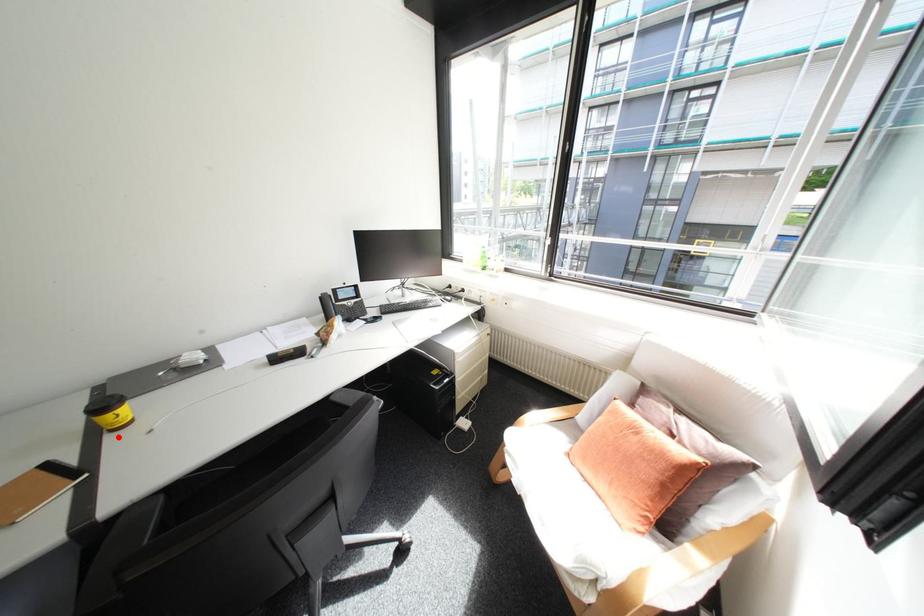
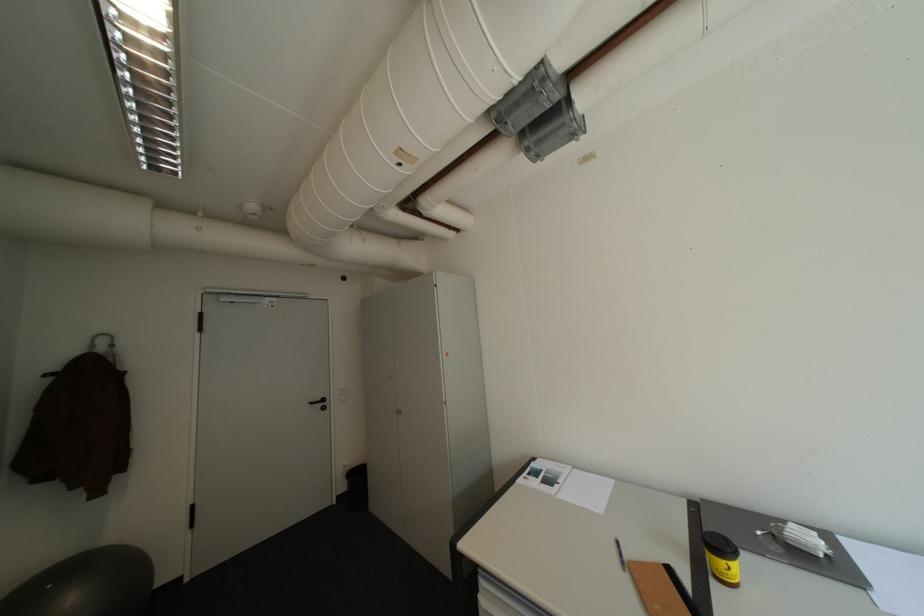
Question: I am providing you with two images of the same scene from different viewpoints. A red point is marked on the first image. At the location where the point appears in image 1, is it still visible in image 2?

Choices:
 (A) Yes
 (B) No

Answer: (A)